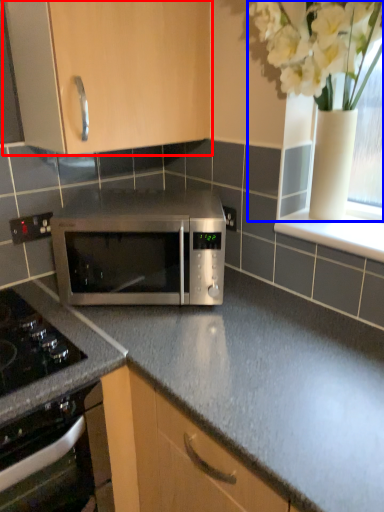
Question: Which object is further to the camera taking this photo, cabinetry (highlighted by a red box) or floral arrangement (highlighted by a blue box)?

Choices:
 (A) cabinetry
 (B) floral arrangement

Answer: (A)